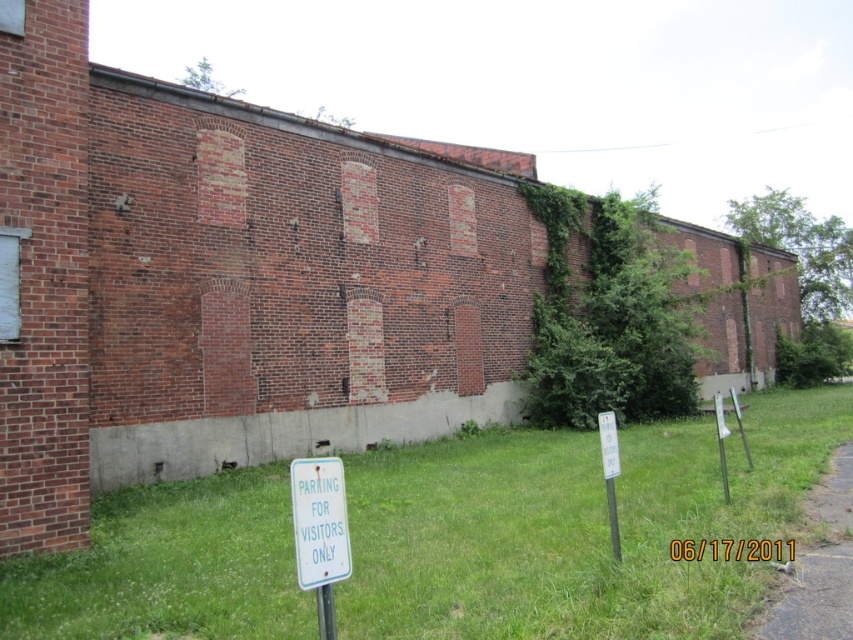
The image size is (853, 640). What do you see at coordinates (577, 525) in the screenshot?
I see `green grass at lower center` at bounding box center [577, 525].

Can you confirm if green grass at lower center is wider than gravel at lower right?

Correct, the width of green grass at lower center exceeds that of gravel at lower right.

Where is `green grass at lower center`? The width and height of the screenshot is (853, 640). green grass at lower center is located at coordinates coord(577,525).

Based on the photo, does gravel at lower right have a smaller size compared to white plastic sign at lower center?

Correct, gravel at lower right occupies less space than white plastic sign at lower center.

Looking at this image, which is more to the right, gravel at lower right or white plastic sign at lower center?

gravel at lower right

Who is more forward, (x=793, y=586) or (x=311, y=502)?

Point (x=311, y=502) is in front.

Locate an element on the screen. Image resolution: width=853 pixels, height=640 pixels. gravel at lower right is located at coordinates (815, 596).

The width and height of the screenshot is (853, 640). I want to click on green grass at lower center, so click(577, 525).

Image resolution: width=853 pixels, height=640 pixels. What do you see at coordinates (577, 525) in the screenshot?
I see `green grass at lower center` at bounding box center [577, 525].

The image size is (853, 640). Find the location of `green grass at lower center`. green grass at lower center is located at coordinates (577, 525).